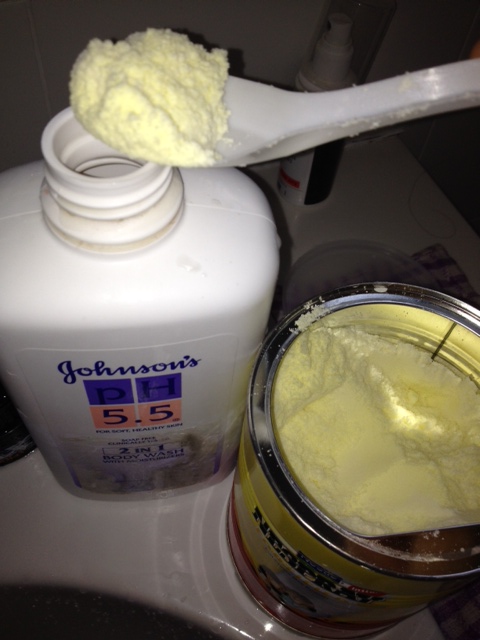
The width and height of the screenshot is (480, 640). I want to click on pump bottle, so click(322, 67).